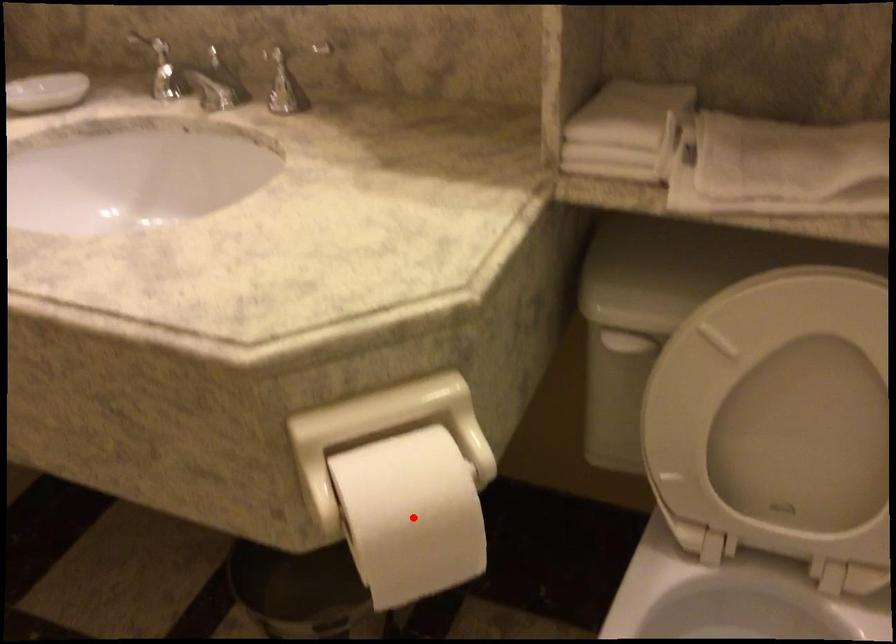
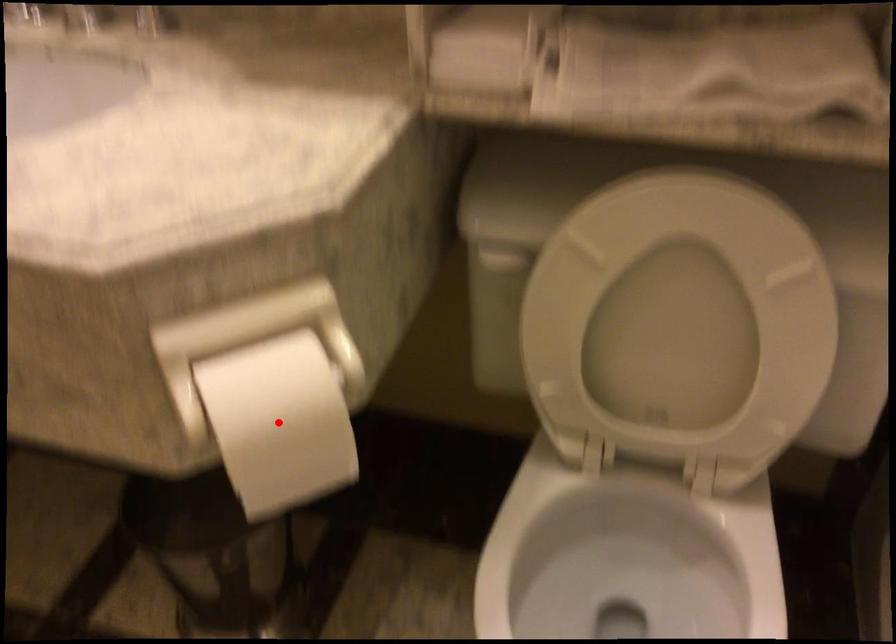
I am providing you with two images of the same scene from different viewpoints. A red point is marked on the first image and another point is marked on the second image. Do the highlighted points in image1 and image2 indicate the same real-world spot?

Yes